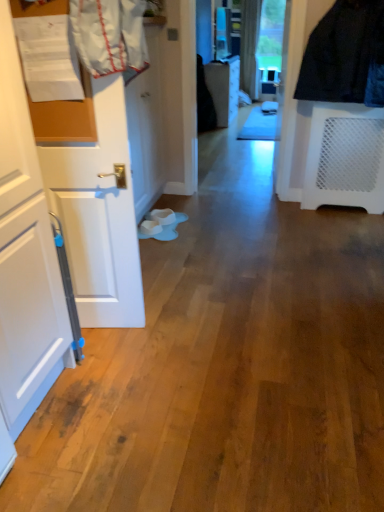
The width and height of the screenshot is (384, 512). Describe the element at coordinates (110, 36) in the screenshot. I see `white fabric laundry at upper left` at that location.

Locate an element on the screen. The width and height of the screenshot is (384, 512). white matte door at left, positioned as the 1th door in front-to-back order is located at coordinates (99, 213).

Between white glossy door at center, the 1th door viewed from the back, and white matte door at left, positioned as the 1th door in front-to-back order, which one is positioned behind?

white glossy door at center, the 1th door viewed from the back, is more distant.

Visually, is white glossy door at center, the 1th door viewed from the back, positioned to the left or to the right of white matte door at left, positioned as the 1th door in front-to-back order?

Based on their positions, white glossy door at center, the 1th door viewed from the back, is located to the right of white matte door at left, positioned as the 1th door in front-to-back order.

Considering the sizes of objects white glossy door at center, the 1th door viewed from the back, and white matte door at left, positioned as the 1th door in front-to-back order, in the image provided, who is smaller, white glossy door at center, the 1th door viewed from the back, or white matte door at left, positioned as the 1th door in front-to-back order,?

white matte door at left, positioned as the 1th door in front-to-back order.

Could you measure the distance between white glossy door at center, placed as the second door when sorted from front to back, and white matte door at left, the second door viewed from the back?

white glossy door at center, placed as the second door when sorted from front to back, is 4.64 feet away from white matte door at left, the second door viewed from the back.

Looking at their sizes, would you say white matte door at left, the second door viewed from the back, is wider or thinner than white glossy door at center, placed as the second door when sorted from front to back?

In the image, white matte door at left, the second door viewed from the back, appears to be wider than white glossy door at center, placed as the second door when sorted from front to back.

Does point (79, 161) appear closer or farther from the camera than point (145, 111)?

Point (79, 161) is positioned closer to the camera compared to point (145, 111).

Image resolution: width=384 pixels, height=512 pixels. Identify the location of door that is above the white glossy door at center, placed as the second door when sorted from front to back (from a real-world perspective). (99, 213).

Who is shorter, white fabric laundry at upper left or white glossy door at center, placed as the second door when sorted from front to back?

With less height is white fabric laundry at upper left.

Which is farther, (94,13) or (140,145)?

The point (140,145) is more distant.

Can you tell me how much white fabric laundry at upper left and white glossy door at center, placed as the second door when sorted from front to back, differ in facing direction?

99 degrees separate the facing orientations of white fabric laundry at upper left and white glossy door at center, placed as the second door when sorted from front to back.

Is white fabric laundry at upper left positioned beyond the bounds of white glossy door at center, the 1th door viewed from the back?

Yes, white fabric laundry at upper left is not within white glossy door at center, the 1th door viewed from the back.

Would you say white glossy door at center, the 1th door viewed from the back, contains white fabric laundry at upper left?

No, white fabric laundry at upper left is not inside white glossy door at center, the 1th door viewed from the back.

What's the angular difference between white glossy door at center, placed as the second door when sorted from front to back, and white fabric laundry at upper left's facing directions?

They differ by 99 degrees in their facing directions.

The height and width of the screenshot is (512, 384). What are the coordinates of `door above the white fabric laundry at upper left (from the image's perspective)` in the screenshot? It's located at (146, 129).

Is white glossy door at center, placed as the second door when sorted from front to back, touching white fabric laundry at upper left?

No, white glossy door at center, placed as the second door when sorted from front to back, is not beside white fabric laundry at upper left.

From a real-world perspective, is white fabric laundry at upper left above or below white matte door at left, positioned as the 1th door in front-to-back order?

In terms of real-world spatial position, white fabric laundry at upper left is above white matte door at left, positioned as the 1th door in front-to-back order.

Consider the image. Could white matte door at left, the second door viewed from the back, be considered to be inside white fabric laundry at upper left?

No, white matte door at left, the second door viewed from the back, is not surrounded by white fabric laundry at upper left.

Who is more distant, white fabric laundry at upper left or white matte door at left, positioned as the 1th door in front-to-back order?

white matte door at left, positioned as the 1th door in front-to-back order, is further from the camera.

Between white fabric laundry at upper left and white matte door at left, the second door viewed from the back, which one has more height?

white matte door at left, the second door viewed from the back, is taller.

Is white fabric laundry at upper left inside white matte door at left, positioned as the 1th door in front-to-back order?

Yes, white fabric laundry at upper left is a part of white matte door at left, positioned as the 1th door in front-to-back order.

How many degrees apart are the facing directions of white matte door at left, the second door viewed from the back, and white fabric laundry at upper left?

They differ by 0.00261 degrees in their facing directions.

Which is behind, white matte door at left, the second door viewed from the back, or white fabric laundry at upper left?

white matte door at left, the second door viewed from the back.

In the scene shown: Which is nearer, [93,200] or [130,7]?

The point [130,7] is closer to the camera.

Identify the location of door above the white glossy door at center, the 1th door viewed from the back (from a real-world perspective). This screenshot has height=512, width=384. (99, 213).

What are the coordinates of `door lying behind the white matte door at left, positioned as the 1th door in front-to-back order` in the screenshot? It's located at (146, 129).

From the image, which object appears to be farther from white glossy door at center, placed as the second door when sorted from front to back, white fabric laundry at upper left or white matte door at left, the second door viewed from the back?

white fabric laundry at upper left lies further to white glossy door at center, placed as the second door when sorted from front to back, than the other object.

When comparing their distances from white matte door at left, the second door viewed from the back, does white glossy door at center, the 1th door viewed from the back, or white fabric laundry at upper left seem closer?

white fabric laundry at upper left lies closer to white matte door at left, the second door viewed from the back, than the other object.

From the image, which object appears to be nearer to white matte door at left, the second door viewed from the back, white fabric laundry at upper left or white glossy door at center, the 1th door viewed from the back?

Based on the image, white fabric laundry at upper left appears to be nearer to white matte door at left, the second door viewed from the back.

Based on the photo, which object lies nearer to the anchor point white glossy door at center, the 1th door viewed from the back, white matte door at left, the second door viewed from the back, or white fabric laundry at upper left?

white matte door at left, the second door viewed from the back.

From the image, which object appears to be farther from white fabric laundry at upper left, white matte door at left, positioned as the 1th door in front-to-back order, or white glossy door at center, placed as the second door when sorted from front to back?

white glossy door at center, placed as the second door when sorted from front to back.

Estimate the real-world distances between objects in this image. Which object is further from white fabric laundry at upper left, white glossy door at center, the 1th door viewed from the back, or white matte door at left, the second door viewed from the back?

white glossy door at center, the 1th door viewed from the back, is positioned further to the anchor white fabric laundry at upper left.

Identify the location of door between white fabric laundry at upper left and white glossy door at center, placed as the second door when sorted from front to back, from front to back. (99, 213).